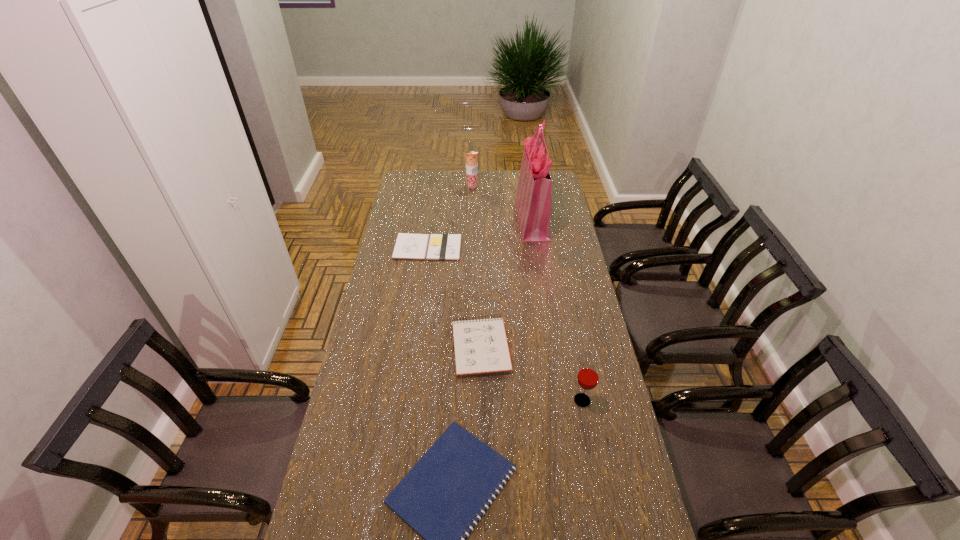
This screenshot has height=540, width=960. I want to click on vacant area at the right edge of the desktop, so click(x=590, y=464).

This screenshot has height=540, width=960. In order to click on vacant space at the far left corner in this screenshot , I will do 408,171.

In order to click on vacant area that lies between the second shortest notepad and the fourth tallest object in this screenshot , I will do `click(454, 297)`.

Identify the location of vacant region between the second nearest notepad and the farthest notepad. (454, 297).

Where is `vacant point located between the tallest object and the second nearest object`? The width and height of the screenshot is (960, 540). vacant point located between the tallest object and the second nearest object is located at coordinates (557, 310).

In order to click on free space between the glass and the farthest object in this screenshot , I will do `click(527, 294)`.

This screenshot has height=540, width=960. Find the location of `unoccupied position between the second nearest notepad and the burrito`. unoccupied position between the second nearest notepad and the burrito is located at coordinates (476, 267).

The image size is (960, 540). In order to click on free space between the tallest notepad and the farthest object in this screenshot , I will do `click(476, 267)`.

This screenshot has width=960, height=540. I want to click on free area in between the second shortest object and the glass, so click(x=505, y=324).

The height and width of the screenshot is (540, 960). Identify the location of vacant space in between the second shortest object and the second nearest object. (505, 324).